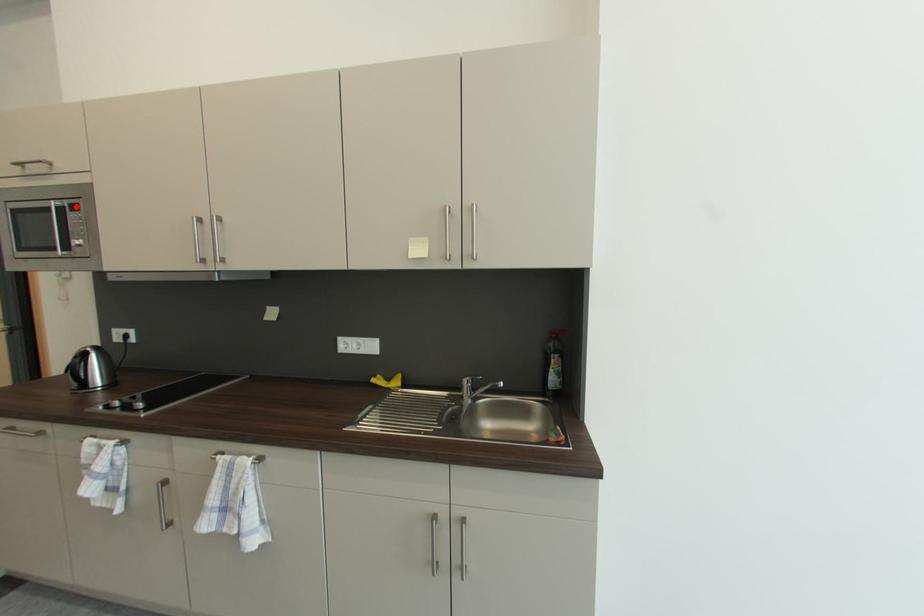
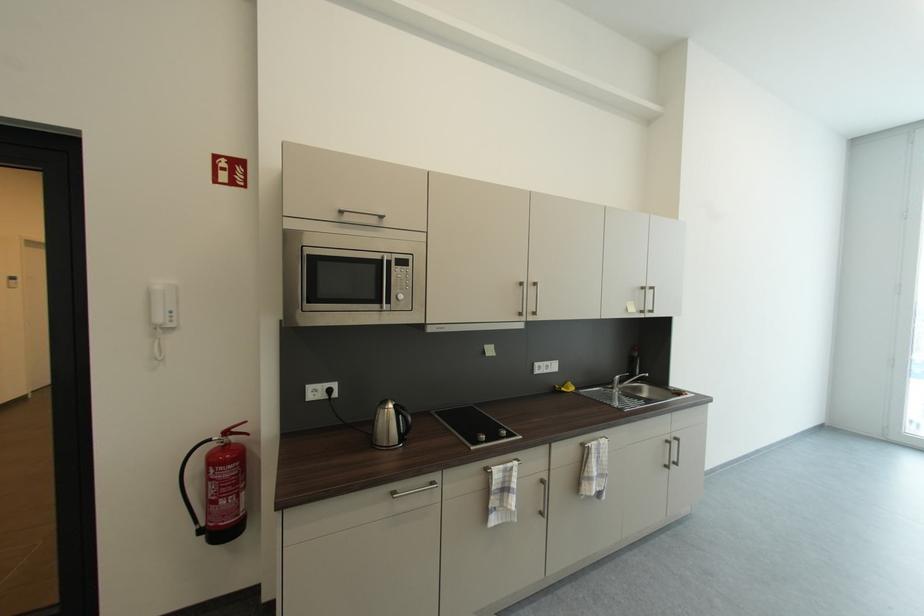
Question: I am providing you with two images of the same scene from different viewpoints. In image1, a red point is highlighted. Considering the same 3D point in image2, which of the following is correct?

Choices:
 (A) It is closer
 (B) It is farther

Answer: (A)